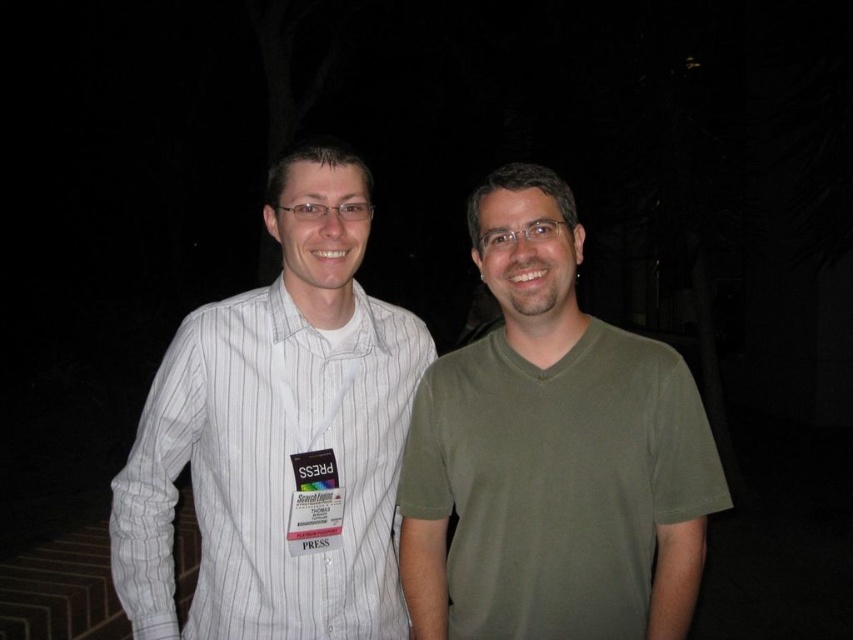
Question: Can you confirm if green matte t-shirt at center is positioned below white striped shirt at left?

Choices:
 (A) no
 (B) yes

Answer: (A)

Question: Which of the following is the closest to the observer?

Choices:
 (A) white striped shirt at left
 (B) green matte t-shirt at center

Answer: (B)

Question: Is the position of green matte t-shirt at center less distant than that of white striped shirt at left?

Choices:
 (A) yes
 (B) no

Answer: (A)

Question: Can you confirm if green matte t-shirt at center is positioned above white striped shirt at left?

Choices:
 (A) yes
 (B) no

Answer: (A)

Question: Which point is farther to the camera?

Choices:
 (A) (276, 550)
 (B) (558, 612)

Answer: (A)